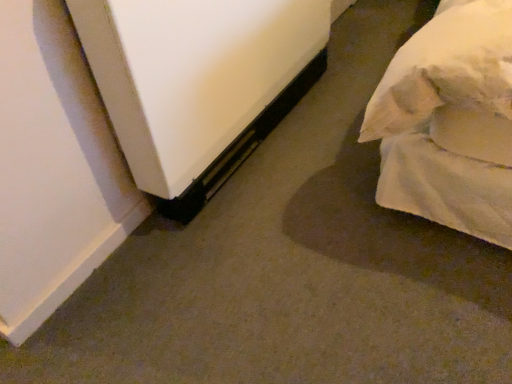
Describe the element at coordinates (150, 126) in the screenshot. I see `white fabric bed at lower right` at that location.

Measure the distance between point (234, 6) and camera.

The distance of point (234, 6) from camera is 3.56 feet.

The height and width of the screenshot is (384, 512). What are the coordinates of `white fabric bed at lower right` in the screenshot? It's located at (150, 126).

Locate an element on the screen. white fabric bed at lower right is located at coordinates (150, 126).